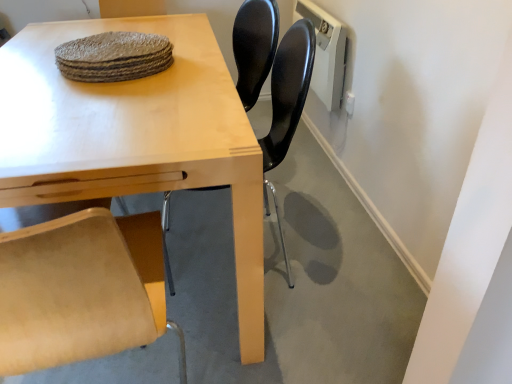
Locate an element on the screen. The image size is (512, 384). vacant area located to the right-hand side of black plastic chair at center is located at coordinates (344, 256).